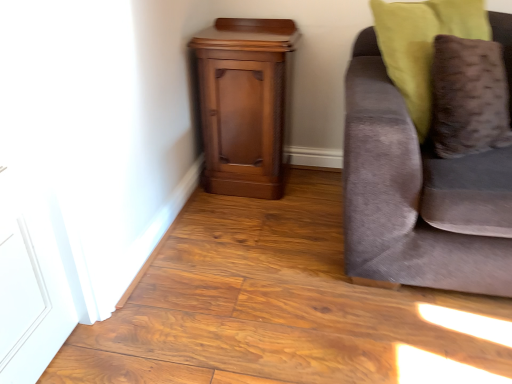
Question: Considering the relative sizes of velvet gray couch at right and polished wood nightstand at lower left in the image provided, is velvet gray couch at right thinner than polished wood nightstand at lower left?

Choices:
 (A) no
 (B) yes

Answer: (A)

Question: Is velvet gray couch at right to the left of polished wood nightstand at lower left from the viewer's perspective?

Choices:
 (A) yes
 (B) no

Answer: (B)

Question: Does velvet gray couch at right come behind polished wood nightstand at lower left?

Choices:
 (A) yes
 (B) no

Answer: (B)

Question: Is velvet gray couch at right smaller than polished wood nightstand at lower left?

Choices:
 (A) yes
 (B) no

Answer: (B)

Question: Considering the relative positions of velvet gray couch at right and polished wood nightstand at lower left in the image provided, is velvet gray couch at right to the right of polished wood nightstand at lower left from the viewer's perspective?

Choices:
 (A) no
 (B) yes

Answer: (B)

Question: Considering the relative sizes of velvet gray couch at right and polished wood nightstand at lower left in the image provided, is velvet gray couch at right taller than polished wood nightstand at lower left?

Choices:
 (A) no
 (B) yes

Answer: (B)

Question: Does polished wood nightstand at lower left contain velvet gray couch at right?

Choices:
 (A) yes
 (B) no

Answer: (B)

Question: From a real-world perspective, is polished wood nightstand at lower left over velvet gray couch at right?

Choices:
 (A) yes
 (B) no

Answer: (B)

Question: Does polished wood nightstand at lower left have a larger size compared to velvet gray couch at right?

Choices:
 (A) yes
 (B) no

Answer: (B)

Question: From the image's perspective, is polished wood nightstand at lower left above velvet gray couch at right?

Choices:
 (A) no
 (B) yes

Answer: (B)

Question: Is polished wood nightstand at lower left smaller than velvet gray couch at right?

Choices:
 (A) yes
 (B) no

Answer: (A)

Question: Is polished wood nightstand at lower left wider than velvet gray couch at right?

Choices:
 (A) yes
 (B) no

Answer: (B)

Question: Does polished wood nightstand at lower left appear on the right side of velvet brown pillow at right?

Choices:
 (A) no
 (B) yes

Answer: (A)